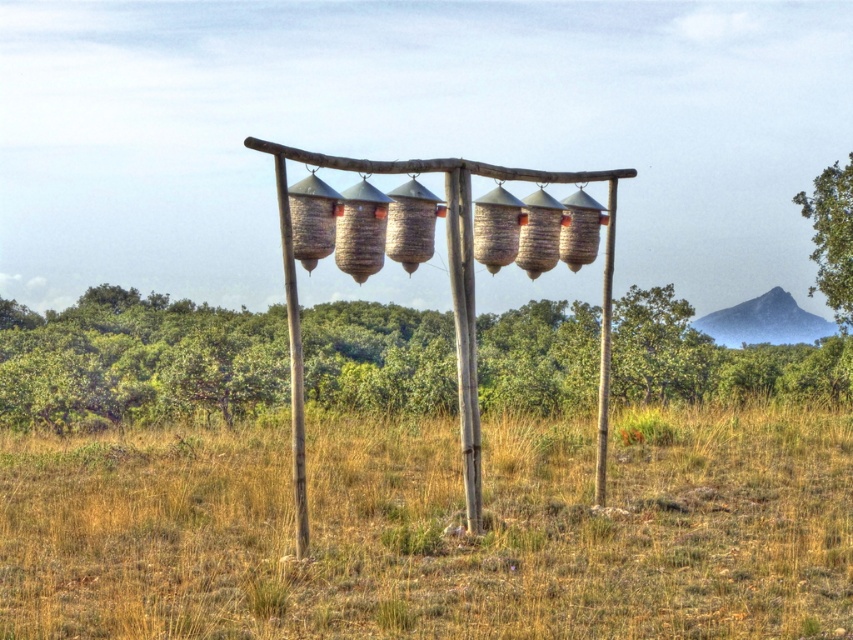
Question: Estimate the real-world distances between objects in this image. Which object is farther from the green leafy tree at center?

Choices:
 (A) green leafy tree at upper right
 (B) dry grass at center

Answer: (B)

Question: Can you confirm if dry grass at center is wider than green leafy tree at upper right?

Choices:
 (A) yes
 (B) no

Answer: (A)

Question: Among these points, which one is farthest from the camera?

Choices:
 (A) (737, 452)
 (B) (820, 186)

Answer: (B)

Question: Is green leafy tree at center above green leafy tree at upper right?

Choices:
 (A) no
 (B) yes

Answer: (A)

Question: In this image, where is green leafy tree at center located relative to green leafy tree at upper right?

Choices:
 (A) above
 (B) below

Answer: (B)

Question: Which point is farther from the camera taking this photo?

Choices:
 (A) (341, 310)
 (B) (842, 292)
 (C) (67, 468)

Answer: (A)